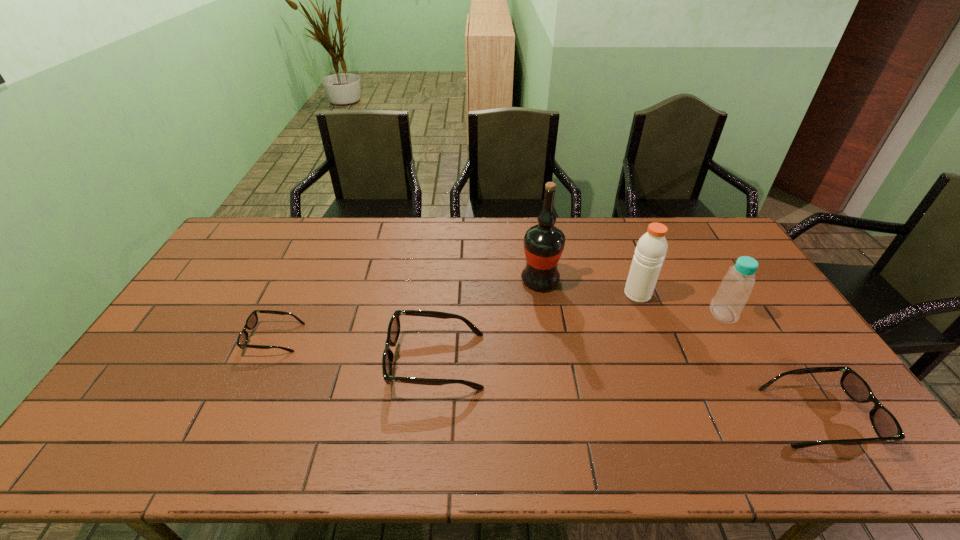
If we want them evenly spaced by inserting an extra spectacles among them, please locate a free spot for this new spectacles. Please provide its 2D coordinates. Your answer should be formatted as a tuple, i.e. [(x, y)], where the tuple contains the x and y coordinates of a point satisfying the conditions above.

[(616, 388)]